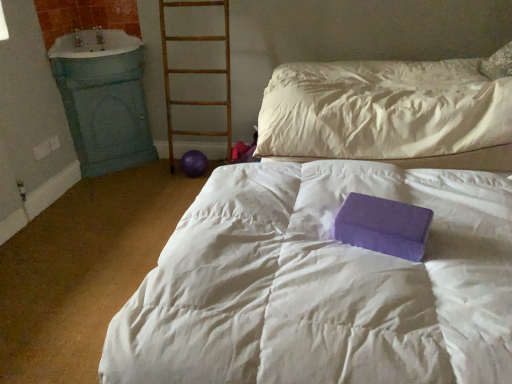
Question: From their relative heights in the image, would you say purple foam block at center is taller or shorter than blue painted wood sink at left?

Choices:
 (A) short
 (B) tall

Answer: (A)

Question: Choose the correct answer: Is purple foam block at center inside blue painted wood sink at left or outside it?

Choices:
 (A) outside
 (B) inside

Answer: (A)

Question: Which is nearer to the purple matte foam block at center?

Choices:
 (A) blue painted wood sink at left
 (B) wooden ladder at center
 (C) purple foam block at center

Answer: (C)

Question: Which object is positioned farthest from the purple matte foam block at center?

Choices:
 (A) blue painted wood sink at left
 (B) purple foam block at center
 (C) wooden ladder at center

Answer: (A)